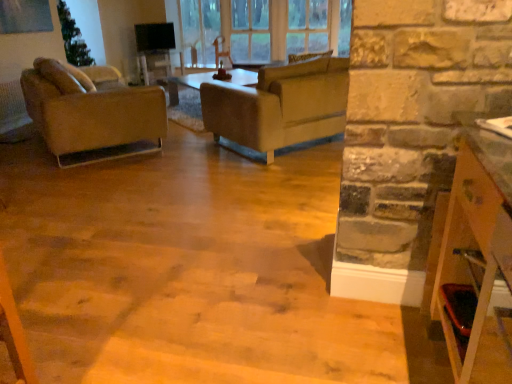
Question: Would you say leather couch at center is inside or outside wooden shelf at right?

Choices:
 (A) outside
 (B) inside

Answer: (A)

Question: Is leather couch at center wider or thinner than wooden shelf at right?

Choices:
 (A) thin
 (B) wide

Answer: (B)

Question: Which object is the closest to the leather couch at center?

Choices:
 (A) matte brown leather chair at left
 (B) clear glass window at upper center
 (C) wooden shelf at right

Answer: (A)

Question: Which of these objects is positioned farthest from the matte brown leather chair at left?

Choices:
 (A) clear glass window at upper center
 (B) leather couch at center
 (C) wooden shelf at right

Answer: (C)